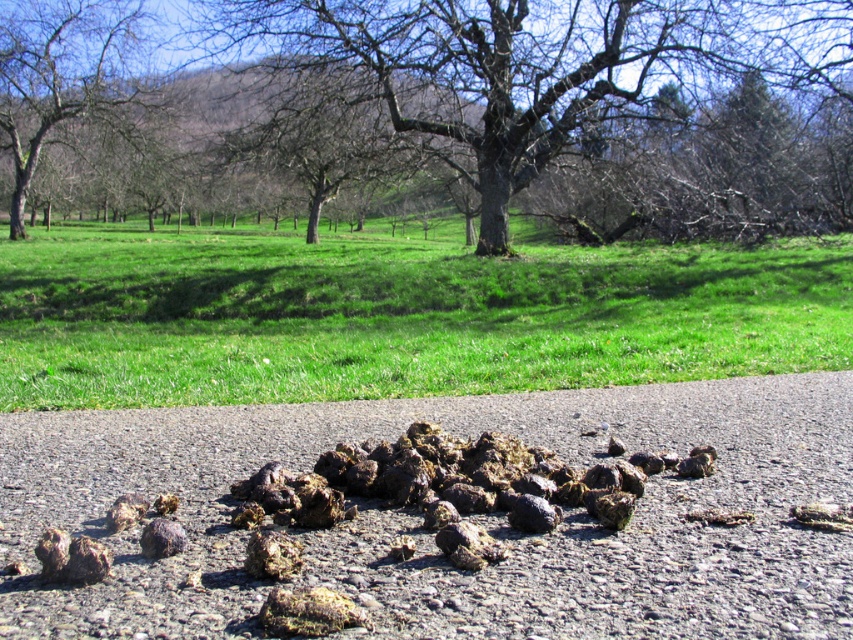
Consider the image. Which is more to the left, bare wood tree at upper left or rusty metallic rock at lower left?

bare wood tree at upper left is more to the left.

Which is behind, point (122, 84) or point (167, 531)?

The point (122, 84) is behind.

The width and height of the screenshot is (853, 640). Identify the location of bare wood tree at upper left. (57, 76).

Can you confirm if smooth bark tree at center is shorter than bare wood tree at upper left?

In fact, smooth bark tree at center may be taller than bare wood tree at upper left.

Who is positioned more to the left, smooth bark tree at center or bare wood tree at upper left?

Positioned to the left is bare wood tree at upper left.

Image resolution: width=853 pixels, height=640 pixels. In order to click on smooth bark tree at center in this screenshot , I will do `click(592, 99)`.

Find the location of `smooth bark tree at center`. smooth bark tree at center is located at coordinates (592, 99).

Between point (799, 116) and point (141, 532), which one is positioned in front?

Positioned in front is point (141, 532).

Who is more forward, (403, 64) or (163, 554)?

Point (163, 554) is in front.

Identify the location of smooth bark tree at center. (592, 99).